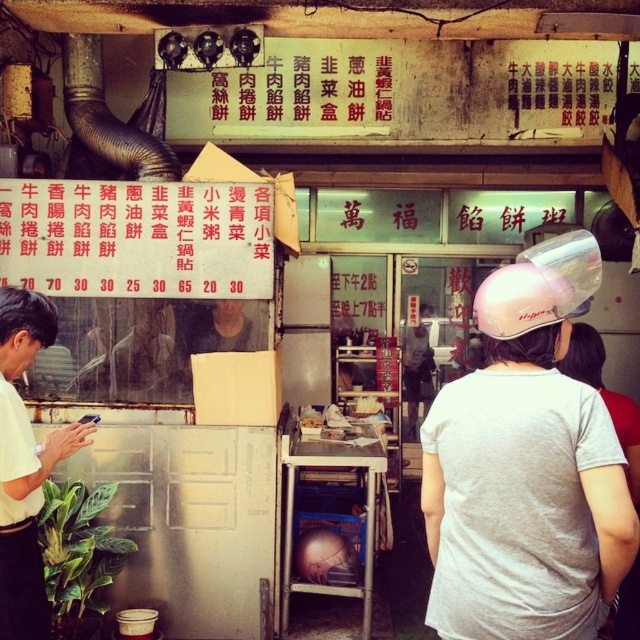
Question: Does pink matte helmet at upper center have a smaller size compared to red paper menu at center?

Choices:
 (A) yes
 (B) no

Answer: (B)

Question: Is pink matte helmet at upper center below white matte shirt at left?

Choices:
 (A) yes
 (B) no

Answer: (B)

Question: Which object is the closest to the red paper menu at center?

Choices:
 (A) white matte shirt at left
 (B) pink matte helmet at upper center

Answer: (A)

Question: Which point appears closest to the camera in this image?

Choices:
 (A) (88, 433)
 (B) (112, 212)

Answer: (A)

Question: Can you confirm if pink matte helmet at upper center is positioned below white matte shirt at left?

Choices:
 (A) no
 (B) yes

Answer: (A)

Question: Which of the following is the closest to the observer?

Choices:
 (A) pink matte helmet at upper center
 (B) red paper menu at center
 (C) white matte shirt at left

Answer: (A)